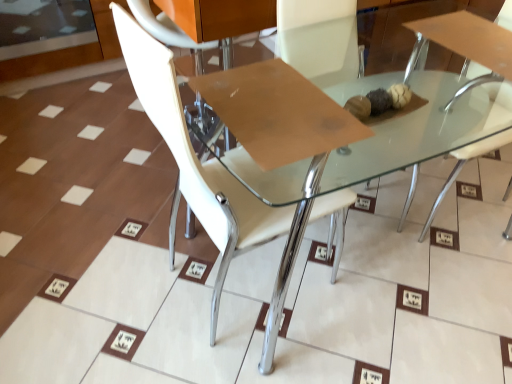
Question: Is clear glass table at center far from brown matte cardboard at center?

Choices:
 (A) yes
 (B) no

Answer: (B)

Question: Considering the relative sizes of clear glass table at center and brown matte cardboard at center in the image provided, is clear glass table at center bigger than brown matte cardboard at center?

Choices:
 (A) yes
 (B) no

Answer: (A)

Question: Considering the relative positions of clear glass table at center and brown matte cardboard at center in the image provided, is clear glass table at center in front of brown matte cardboard at center?

Choices:
 (A) yes
 (B) no

Answer: (A)

Question: Is clear glass table at center completely or partially outside of brown matte cardboard at center?

Choices:
 (A) no
 (B) yes

Answer: (B)

Question: Can you confirm if clear glass table at center is positioned to the left of brown matte cardboard at center?

Choices:
 (A) yes
 (B) no

Answer: (B)

Question: In the image, is brown matte cardboard at center positioned in front of or behind white glossy chair at center, which is the second chair in right-to-left order?

Choices:
 (A) front
 (B) behind

Answer: (B)

Question: From a real-world perspective, is brown matte cardboard at center physically located above or below white glossy chair at center, which is the second chair in right-to-left order?

Choices:
 (A) above
 (B) below

Answer: (A)

Question: Do you think brown matte cardboard at center is within white glossy chair at center, which is the second chair in right-to-left order, or outside of it?

Choices:
 (A) outside
 (B) inside

Answer: (B)

Question: From the image's perspective, is brown matte cardboard at center positioned above or below white glossy chair at center, the 1th chair in the left-to-right sequence?

Choices:
 (A) below
 (B) above

Answer: (B)

Question: Would you say white glossy chair at upper right, which is the 1th chair from right to left, is inside or outside white glossy chair at center, which is the second chair in right-to-left order?

Choices:
 (A) inside
 (B) outside

Answer: (B)

Question: In the image, is white glossy chair at upper right, the 2th chair positioned from the left, on the left side or the right side of white glossy chair at center, the 1th chair in the left-to-right sequence?

Choices:
 (A) left
 (B) right

Answer: (B)

Question: From a real-world perspective, is white glossy chair at upper right, the 2th chair positioned from the left, physically located above or below white glossy chair at center, the 1th chair in the left-to-right sequence?

Choices:
 (A) above
 (B) below

Answer: (B)

Question: Is white glossy chair at upper right, the 2th chair positioned from the left, bigger or smaller than white glossy chair at center, the 1th chair in the left-to-right sequence?

Choices:
 (A) big
 (B) small

Answer: (B)

Question: Considering the relative positions of brown matte cardboard at center and transparent glass door at upper left in the image provided, is brown matte cardboard at center to the left or to the right of transparent glass door at upper left?

Choices:
 (A) left
 (B) right

Answer: (B)

Question: From their relative heights in the image, would you say brown matte cardboard at center is taller or shorter than transparent glass door at upper left?

Choices:
 (A) short
 (B) tall

Answer: (A)